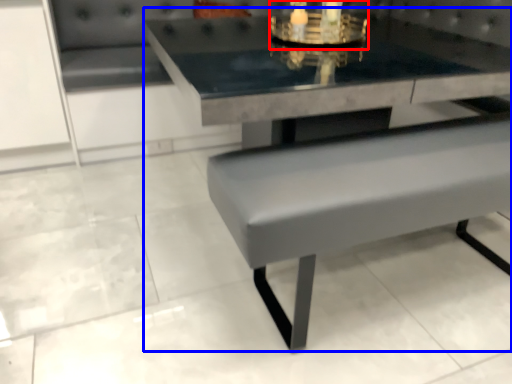
Question: Among these objects, which one is farthest to the camera, candle holder (highlighted by a red box) or picnic table (highlighted by a blue box)?

Choices:
 (A) candle holder
 (B) picnic table

Answer: (A)